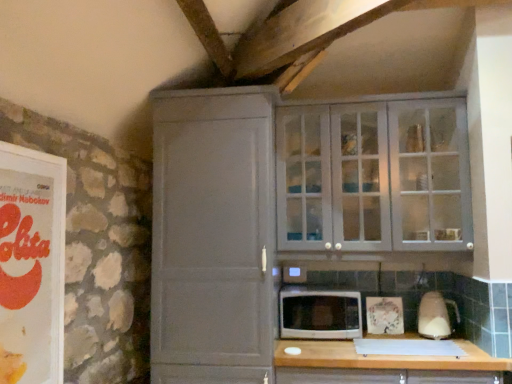
Question: Is white glossy microwave at center positioned with its back to matte orange book at left?

Choices:
 (A) no
 (B) yes

Answer: (A)

Question: Is white glossy microwave at center to the left of matte orange book at left from the viewer's perspective?

Choices:
 (A) no
 (B) yes

Answer: (A)

Question: Does white glossy microwave at center have a lesser width compared to matte orange book at left?

Choices:
 (A) no
 (B) yes

Answer: (A)

Question: From the image's perspective, is white glossy microwave at center located beneath matte orange book at left?

Choices:
 (A) no
 (B) yes

Answer: (B)

Question: Does white glossy microwave at center have a smaller size compared to matte orange book at left?

Choices:
 (A) no
 (B) yes

Answer: (A)

Question: Considering the positions of matte gray cabinet at upper right, which appears as the 1th cupboard when viewed from the right, and matte gray cabinet at center, which is the 2th cupboard from right to left, in the image, is matte gray cabinet at upper right, which appears as the 1th cupboard when viewed from the right, bigger or smaller than matte gray cabinet at center, which is the 2th cupboard from right to left,?

Choices:
 (A) small
 (B) big

Answer: (A)

Question: Considering the relative positions of matte gray cabinet at upper right, which appears as the second cupboard when viewed from the left, and matte gray cabinet at center, which is the 2th cupboard from right to left, in the image provided, is matte gray cabinet at upper right, which appears as the second cupboard when viewed from the left, to the left or to the right of matte gray cabinet at center, which is the 2th cupboard from right to left,?

Choices:
 (A) right
 (B) left

Answer: (A)

Question: Is matte gray cabinet at upper right, which appears as the second cupboard when viewed from the left, in front of or behind matte gray cabinet at center, which ranks as the first cupboard in left-to-right order, in the image?

Choices:
 (A) behind
 (B) front

Answer: (A)

Question: From a real-world perspective, is matte gray cabinet at upper right, which appears as the second cupboard when viewed from the left, above or below matte gray cabinet at center, which is the 2th cupboard from right to left?

Choices:
 (A) below
 (B) above

Answer: (B)

Question: Considering the positions of matte gray cabinet at center, which is the 2th cupboard from right to left, and wooden at lower center in the image, is matte gray cabinet at center, which is the 2th cupboard from right to left, taller or shorter than wooden at lower center?

Choices:
 (A) tall
 (B) short

Answer: (A)

Question: From the image's perspective, relative to wooden at lower center, is matte gray cabinet at center, which is the 2th cupboard from right to left, above or below?

Choices:
 (A) below
 (B) above

Answer: (B)

Question: In terms of size, does matte gray cabinet at center, which is the 2th cupboard from right to left, appear bigger or smaller than wooden at lower center?

Choices:
 (A) small
 (B) big

Answer: (B)

Question: From a real-world perspective, relative to wooden at lower center, is matte gray cabinet at center, which is the 2th cupboard from right to left, vertically above or below?

Choices:
 (A) above
 (B) below

Answer: (A)

Question: Considering the positions of white glossy blender at right and matte orange book at left in the image, is white glossy blender at right taller or shorter than matte orange book at left?

Choices:
 (A) tall
 (B) short

Answer: (B)

Question: In the image, is white glossy blender at right on the left side or the right side of matte orange book at left?

Choices:
 (A) left
 (B) right

Answer: (B)